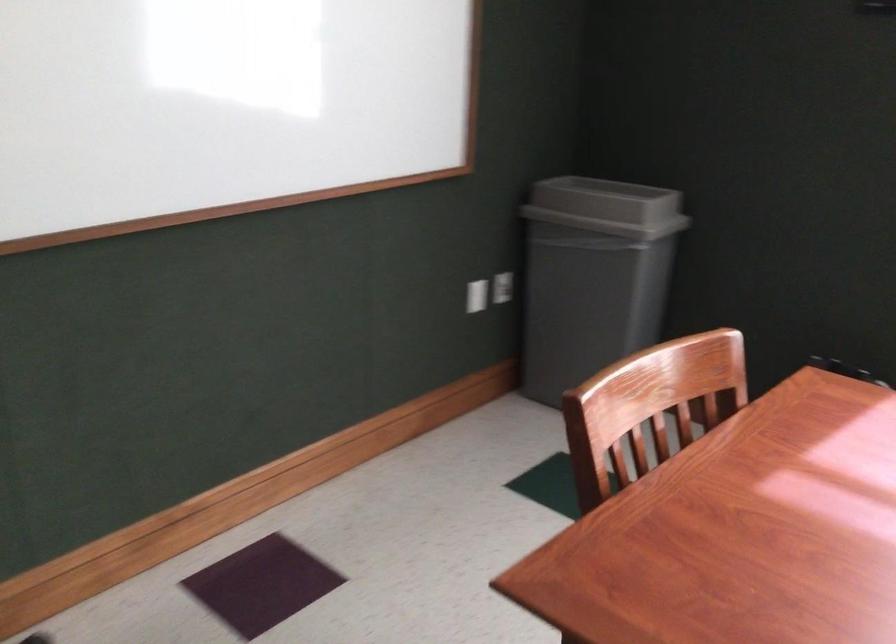
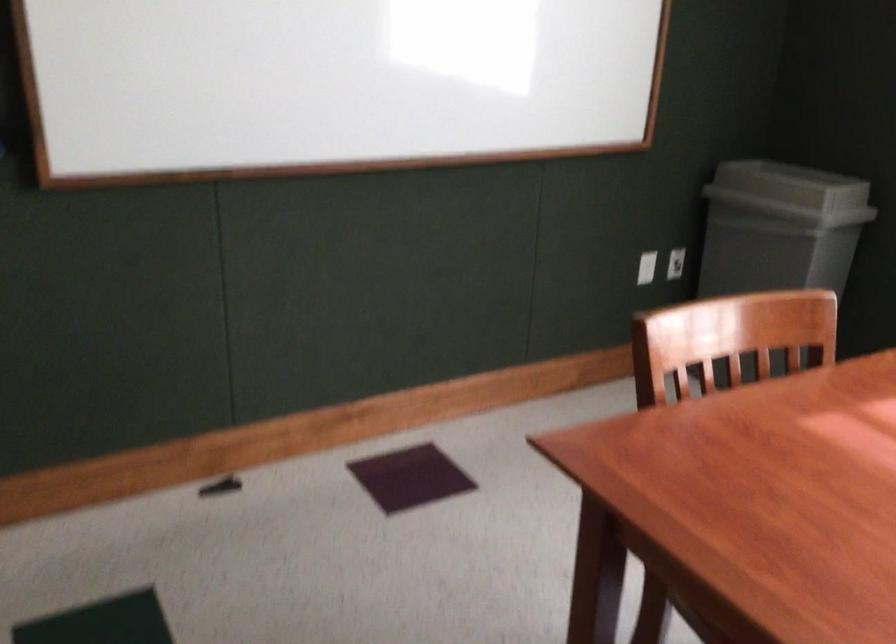
Question: Based on the continuous images, in which direction is the camera rotating? Reply with the corresponding letter.

Choices:
 (A) Left
 (B) Right
 (C) Up
 (D) Down

Answer: (A)